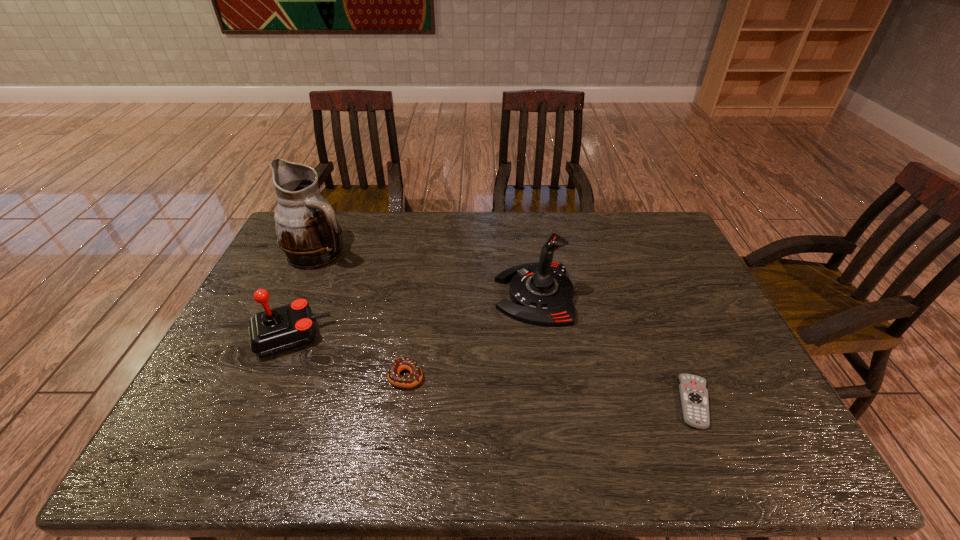
Locate an element on the screen. This screenshot has width=960, height=540. free space located 0.100m on the handle side of the fourth object from left to right is located at coordinates (463, 294).

The width and height of the screenshot is (960, 540). I want to click on free location located on the handle side of the fourth object from left to right, so click(417, 294).

This screenshot has width=960, height=540. I want to click on free space located 0.140m on the handle side of the fourth object from left to right, so click(x=449, y=294).

At what (x,y) coordinates should I click in order to perform the action: click on blank area located 0.240m on the back of the third shortest object. Please return your answer as a coordinate pair (x, y). Looking at the image, I should click on (322, 262).

You are a GUI agent. You are given a task and a screenshot of the screen. Output one action in this format:
    pyautogui.click(x=<x>, y=<y>)
    Task: Click on the free space located 0.120m on the back of the third object from right to left
    
    Given the screenshot: What is the action you would take?
    pyautogui.click(x=414, y=329)

Identify the location of free space located on the left of the rightmost object. (613, 402).

Find the location of a particular element. This screenshot has width=960, height=540. object present at the far edge is located at coordinates (308, 233).

The height and width of the screenshot is (540, 960). Find the location of `pitcher at the left edge`. pitcher at the left edge is located at coordinates (308, 233).

The height and width of the screenshot is (540, 960). I want to click on joystick that is at the left edge, so click(272, 331).

Identify the location of object located at the right edge. (694, 395).